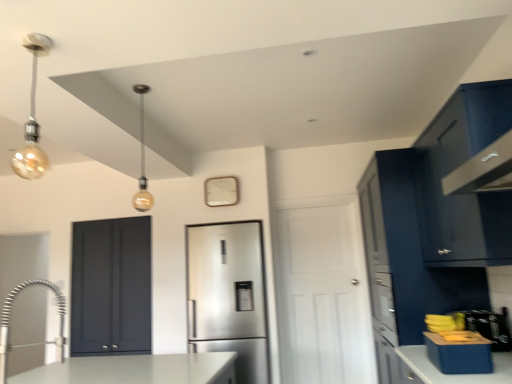
Measure the distance between point (499, 144) and camera.

The depth of point (499, 144) is 1.66 meters.

Find the location of a particular element. glossy dark blue cabinet at upper right, which appears as the 2th cabinetry when viewed from the back is located at coordinates (468, 178).

This screenshot has height=384, width=512. Describe the element at coordinates (221, 191) in the screenshot. I see `metallic square clock at upper center` at that location.

Image resolution: width=512 pixels, height=384 pixels. Find the location of `matte blue cabinet at right, the second cabinetry when ordered from front to back`. matte blue cabinet at right, the second cabinetry when ordered from front to back is located at coordinates (405, 264).

Image resolution: width=512 pixels, height=384 pixels. In order to click on matte dark blue cabinet at left, the second door positioned from the right in this screenshot , I will do 111,286.

Considering the positions of point (488, 186) and point (246, 318), is point (488, 186) closer or farther from the camera than point (246, 318)?

Clearly, point (488, 186) is closer to the camera than point (246, 318).

Which of these two, glossy dark blue cabinet at upper right, which appears as the 2th cabinetry when viewed from the back, or satin stainless steel refrigerator at center, is wider?

glossy dark blue cabinet at upper right, which appears as the 2th cabinetry when viewed from the back, is wider.

Which object is closer to the camera taking this photo, glossy dark blue cabinet at upper right, which ranks as the first cabinetry in front-to-back order, or satin stainless steel refrigerator at center?

glossy dark blue cabinet at upper right, which ranks as the first cabinetry in front-to-back order, is more forward.

Is glossy dark blue cabinet at upper right, which appears as the 2th cabinetry when viewed from the back, to the right of satin stainless steel refrigerator at center from the viewer's perspective?

Indeed, glossy dark blue cabinet at upper right, which appears as the 2th cabinetry when viewed from the back, is positioned on the right side of satin stainless steel refrigerator at center.

From the picture: Who is bigger, matte blue cabinet at right, which is the 1th cabinetry from back to front, or satin stainless steel refrigerator at center?

With larger size is matte blue cabinet at right, which is the 1th cabinetry from back to front.

From a real-world perspective, which cabinetry is the 1st one above the satin stainless steel refrigerator at center? Please provide its 2D coordinates.

[(405, 264)]

In the scene shown: Are matte blue cabinet at right, the second cabinetry when ordered from front to back, and satin stainless steel refrigerator at center making contact?

There is a gap between matte blue cabinet at right, the second cabinetry when ordered from front to back, and satin stainless steel refrigerator at center.

Which object is more forward, gold metallic light bulb at upper left, acting as the 2th light fixture starting from the left, or matte blue cabinet at right, which is the 1th cabinetry from back to front?

matte blue cabinet at right, which is the 1th cabinetry from back to front, is more forward.

Consider the image. Is gold metallic light bulb at upper left, acting as the 2th light fixture starting from the left, inside or outside of matte blue cabinet at right, which is the 1th cabinetry from back to front?

gold metallic light bulb at upper left, acting as the 2th light fixture starting from the left, is not enclosed by matte blue cabinet at right, which is the 1th cabinetry from back to front.

Considering the positions of objects gold metallic light bulb at upper left, acting as the 2th light fixture starting from the left, and matte blue cabinet at right, which is the 1th cabinetry from back to front, in the image provided, who is more to the right, gold metallic light bulb at upper left, acting as the 2th light fixture starting from the left, or matte blue cabinet at right, which is the 1th cabinetry from back to front,?

From the viewer's perspective, matte blue cabinet at right, which is the 1th cabinetry from back to front, appears more on the right side.

From a real-world perspective, is gold metallic light bulb at upper left, the 1th light fixture positioned from the right, beneath matte blue cabinet at right, which is the 1th cabinetry from back to front?

No.

From a real-world perspective, which light fixture is the 1st one above the matte blue cabinet at right, which is the 1th cabinetry from back to front? Please provide its 2D coordinates.

[(32, 118)]

Is matte blue cabinet at right, which is the 1th cabinetry from back to front, oriented towards gold bulb at upper left, which appears as the 1th light fixture when viewed from the front?

No.

Is matte blue cabinet at right, the second cabinetry when ordered from front to back, behind gold bulb at upper left, which appears as the 1th light fixture when viewed from the front?

Yes.

Which is behind, point (411, 249) or point (36, 124)?

Point (411, 249)

Can you tell me how much satin nickel faucet at lower left and matte blue cabinet at right, the second cabinetry when ordered from front to back, differ in facing direction?

The angle between the facing direction of satin nickel faucet at lower left and the facing direction of matte blue cabinet at right, the second cabinetry when ordered from front to back, is 179 degrees.

Does satin nickel faucet at lower left have a lesser width compared to matte blue cabinet at right, the second cabinetry when ordered from front to back?

Yes.

From the picture: Considering the sizes of objects satin nickel faucet at lower left and matte blue cabinet at right, which is the 1th cabinetry from back to front, in the image provided, who is taller, satin nickel faucet at lower left or matte blue cabinet at right, which is the 1th cabinetry from back to front,?

matte blue cabinet at right, which is the 1th cabinetry from back to front, is taller.

From the image's perspective, which one is positioned higher, satin nickel faucet at lower left or matte blue cabinet at right, the second cabinetry when ordered from front to back?

satin nickel faucet at lower left appears higher in the image.

Would you say metallic square clock at upper center is to the left or to the right of white matte door at center, which is counted as the 1th door, starting from the right, in the picture?

In the image, metallic square clock at upper center appears on the left side of white matte door at center, which is counted as the 1th door, starting from the right.

Can you confirm if metallic square clock at upper center is taller than white matte door at center, which is counted as the 1th door, starting from the right?

In fact, metallic square clock at upper center may be shorter than white matte door at center, which is counted as the 1th door, starting from the right.

Which object is wider, metallic square clock at upper center or white matte door at center, arranged as the 2th door when viewed from the left?

white matte door at center, arranged as the 2th door when viewed from the left.

Is white matte door at center, which is counted as the 1th door, starting from the right, completely or partially inside metallic square clock at upper center?

Definitely not — white matte door at center, which is counted as the 1th door, starting from the right, is not inside metallic square clock at upper center.

Considering the sizes of objects white matte door at center, arranged as the 2th door when viewed from the left, and satin nickel faucet at lower left in the image provided, who is shorter, white matte door at center, arranged as the 2th door when viewed from the left, or satin nickel faucet at lower left?

Standing shorter between the two is satin nickel faucet at lower left.

Which is closer to the camera, (x=293, y=322) or (x=4, y=324)?

Clearly, point (x=293, y=322) is more distant from the camera than point (x=4, y=324).

Is white matte door at center, arranged as the 2th door when viewed from the left, in front of satin nickel faucet at lower left?

No, white matte door at center, arranged as the 2th door when viewed from the left, is further to the viewer.

Can you tell me how much white matte door at center, arranged as the 2th door when viewed from the left, and satin nickel faucet at lower left differ in facing direction?

The angular difference between white matte door at center, arranged as the 2th door when viewed from the left, and satin nickel faucet at lower left is 92.3 degrees.

Image resolution: width=512 pixels, height=384 pixels. In order to click on refrigerator below the glossy dark blue cabinet at upper right, which ranks as the first cabinetry in front-to-back order (from the image's perspective) in this screenshot , I will do `click(228, 295)`.

Image resolution: width=512 pixels, height=384 pixels. Find the location of `refrigerator that is under the matte blue cabinet at right, the second cabinetry when ordered from front to back (from a real-world perspective)`. refrigerator that is under the matte blue cabinet at right, the second cabinetry when ordered from front to back (from a real-world perspective) is located at coordinates (228, 295).

Considering their positions, is glossy dark blue cabinet at upper right, which ranks as the first cabinetry in front-to-back order, positioned further to satin stainless steel refrigerator at center than metallic square clock at upper center?

glossy dark blue cabinet at upper right, which ranks as the first cabinetry in front-to-back order.

Which object lies further to the anchor point matte blue cabinet at right, which is the 1th cabinetry from back to front, metallic square clock at upper center or white matte door at center, arranged as the 2th door when viewed from the left?

metallic square clock at upper center is further to matte blue cabinet at right, which is the 1th cabinetry from back to front.

Looking at the image, which one is located closer to glossy dark blue cabinet at upper right, which appears as the 2th cabinetry when viewed from the back, matte blue cabinet at right, which is the 1th cabinetry from back to front, or gold bulb at upper left, arranged as the first light fixture when viewed from the left?

matte blue cabinet at right, which is the 1th cabinetry from back to front, lies closer to glossy dark blue cabinet at upper right, which appears as the 2th cabinetry when viewed from the back, than the other object.

Which object lies nearer to the anchor point white matte door at center, which is counted as the 1th door, starting from the right, matte blue cabinet at right, the second cabinetry when ordered from front to back, or satin nickel faucet at lower left?

Among the two, matte blue cabinet at right, the second cabinetry when ordered from front to back, is located nearer to white matte door at center, which is counted as the 1th door, starting from the right.

Estimate the real-world distances between objects in this image. Which object is further from metallic square clock at upper center, gold metallic light bulb at upper left, acting as the 2th light fixture starting from the left, or satin stainless steel refrigerator at center?

The object further to metallic square clock at upper center is satin stainless steel refrigerator at center.

Consider the image. Estimate the real-world distances between objects in this image. Which object is closer to matte blue cabinet at right, the second cabinetry when ordered from front to back, gold metallic light bulb at upper left, the 1th light fixture positioned from the right, or glossy dark blue cabinet at upper right, which ranks as the first cabinetry in front-to-back order?

glossy dark blue cabinet at upper right, which ranks as the first cabinetry in front-to-back order, lies closer to matte blue cabinet at right, the second cabinetry when ordered from front to back, than the other object.

Looking at the image, which one is located further to matte blue cabinet at right, the second cabinetry when ordered from front to back, satin stainless steel refrigerator at center or metallic square clock at upper center?

metallic square clock at upper center.

Looking at this image, based on their spatial positions, is gold bulb at upper left, arranged as the first light fixture when viewed from the left, or satin nickel faucet at lower left further from glossy dark blue cabinet at upper right, which appears as the 2th cabinetry when viewed from the back?

satin nickel faucet at lower left.

I want to click on light fixture between satin nickel faucet at lower left and gold metallic light bulb at upper left, the 1th light fixture positioned from the right, along the z-axis, so click(x=32, y=118).

This screenshot has height=384, width=512. I want to click on door between matte dark blue cabinet at left, the second door positioned from the right, and matte blue cabinet at right, which is the 1th cabinetry from back to front, in the horizontal direction, so point(322,296).

Image resolution: width=512 pixels, height=384 pixels. I want to click on door between satin stainless steel refrigerator at center and matte blue cabinet at right, the second cabinetry when ordered from front to back, in the horizontal direction, so click(x=322, y=296).

This screenshot has height=384, width=512. In order to click on refrigerator between gold metallic light bulb at upper left, the 1th light fixture positioned from the right, and matte blue cabinet at right, which is the 1th cabinetry from back to front, from left to right in this screenshot , I will do `click(228, 295)`.